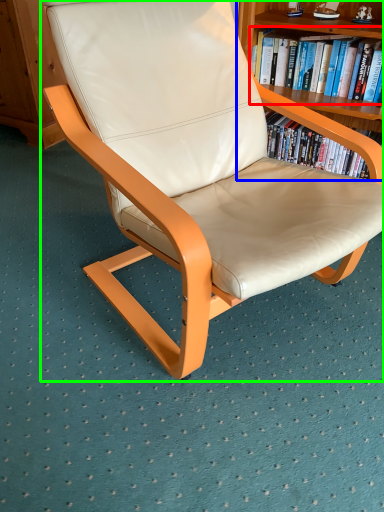
Question: Considering the real-world distances, which object is closest to book (highlighted by a red box)? bookcase (highlighted by a blue box) or chair (highlighted by a green box).

Choices:
 (A) bookcase
 (B) chair

Answer: (A)